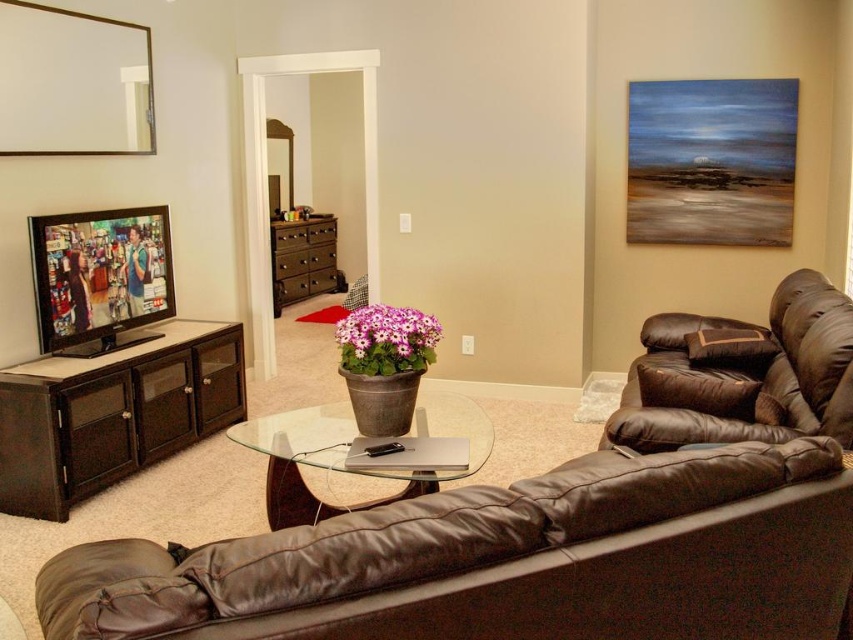
Does point (57, 360) come behind point (44, 275)?

That is True.

Describe the element at coordinates (113, 413) in the screenshot. The image size is (853, 640). I see `dark brown wood entertainment center at left` at that location.

Does point (157, 356) lie in front of point (128, 218)?

Yes, it is in front of point (128, 218).

At what (x,y) coordinates should I click in order to perform the action: click on dark brown wood entertainment center at left. Please return your answer as a coordinate pair (x, y). Image resolution: width=853 pixels, height=640 pixels. Looking at the image, I should click on click(x=113, y=413).

Does brown leather armchair at right have a greater height compared to oil painting at upper right?

In fact, brown leather armchair at right may be shorter than oil painting at upper right.

Between brown leather armchair at right and oil painting at upper right, which one is positioned higher?

oil painting at upper right is higher up.

Measure the distance between point (805, 340) and camera.

2.78 meters

Identify the location of brown leather armchair at right. The width and height of the screenshot is (853, 640). (743, 376).

From the picture: Can you confirm if oil painting at upper right is positioned to the right of matte black television at left?

Correct, you'll find oil painting at upper right to the right of matte black television at left.

Who is more distant from viewer, (792, 131) or (109, 332)?

Point (792, 131)

Image resolution: width=853 pixels, height=640 pixels. In order to click on oil painting at upper right in this screenshot , I will do `click(711, 161)`.